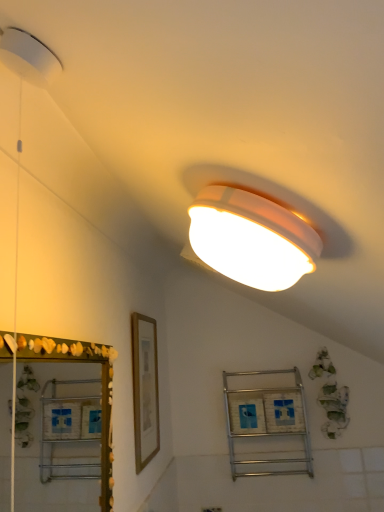
The height and width of the screenshot is (512, 384). Find the location of `white plastic electric outlet at lower center`. white plastic electric outlet at lower center is located at coordinates (211, 509).

The width and height of the screenshot is (384, 512). In order to click on green shell mirror at left in this screenshot , I will do `click(49, 483)`.

Describe the element at coordinates (145, 389) in the screenshot. This screenshot has width=384, height=512. I see `gold wooden picture frame at center-left` at that location.

At what (x,y) coordinates should I click in order to perform the action: click on white plastic electric outlet at lower center. Please return your answer as a coordinate pair (x, y). Looking at the image, I should click on (211, 509).

Can green shell mirror at left be found inside metallic silver shelf at center?

Actually, green shell mirror at left is outside metallic silver shelf at center.

Does metallic silver shelf at center have a greater width compared to green shell mirror at left?

Indeed, metallic silver shelf at center has a greater width compared to green shell mirror at left.

Which of these two, metallic silver shelf at center or green shell mirror at left, is smaller?

green shell mirror at left.

From a real-world perspective, between metallic silver shelf at center and green shell mirror at left, who is vertically higher?

green shell mirror at left is physically above.

Considering the sizes of objects gold wooden picture frame at center-left and green shell mirror at left in the image provided, who is wider, gold wooden picture frame at center-left or green shell mirror at left?

green shell mirror at left is wider.

Are gold wooden picture frame at center-left and green shell mirror at left beside each other?

There is a gap between gold wooden picture frame at center-left and green shell mirror at left.

You are a GUI agent. You are given a task and a screenshot of the screen. Output one action in this format:
    pyautogui.click(x=<x>, y=<y>)
    Task: Click on the picture frame located behind the green shell mirror at left
    This screenshot has height=512, width=384.
    Given the screenshot: What is the action you would take?
    pyautogui.click(x=145, y=389)

How different are the orientations of gold wooden picture frame at center-left and green shell mirror at left in degrees?

0.395 degrees.

Between white plastic electric outlet at lower center and metallic silver shelf at center, which one has smaller width?

white plastic electric outlet at lower center.

What are the coordinates of `electric outlet below the metallic silver shelf at center (from the image's perspective)` in the screenshot? It's located at (211, 509).

From a real-world perspective, which is physically above, white plastic electric outlet at lower center or metallic silver shelf at center?

From a 3D spatial view, metallic silver shelf at center is above.

Is white plastic electric outlet at lower center in front of or behind metallic silver shelf at center in the image?

white plastic electric outlet at lower center is behind metallic silver shelf at center.

Consider the image. Considering the sizes of green shell mirror at left and gold wooden picture frame at center-left in the image, is green shell mirror at left taller or shorter than gold wooden picture frame at center-left?

Clearly, green shell mirror at left is shorter compared to gold wooden picture frame at center-left.

Is green shell mirror at left aimed at gold wooden picture frame at center-left?

No, green shell mirror at left does not turn towards gold wooden picture frame at center-left.

Is green shell mirror at left with gold wooden picture frame at center-left?

No, green shell mirror at left is not next to gold wooden picture frame at center-left.

Does green shell mirror at left appear on the left side of metallic silver shelf at center?

Indeed, green shell mirror at left is positioned on the left side of metallic silver shelf at center.

What are the coordinates of `shelf behind the green shell mirror at left` in the screenshot? It's located at (267, 423).

Between green shell mirror at left and metallic silver shelf at center, which one is positioned in front?

green shell mirror at left is more forward.

Is green shell mirror at left next to metallic silver shelf at center?

No, green shell mirror at left is not with metallic silver shelf at center.

How distant is white plastic electric outlet at lower center from gold wooden picture frame at center-left?

They are 72.80 centimeters apart.

Consider the image. Does white plastic electric outlet at lower center have a smaller size compared to gold wooden picture frame at center-left?

Yes.

Can you confirm if white plastic electric outlet at lower center is positioned to the right of gold wooden picture frame at center-left?

Yes, white plastic electric outlet at lower center is to the right of gold wooden picture frame at center-left.

Do you think white plastic electric outlet at lower center is within gold wooden picture frame at center-left, or outside of it?

The correct answer is: outside.

Looking at their sizes, would you say gold wooden picture frame at center-left is wider or thinner than metallic silver shelf at center?

Clearly, gold wooden picture frame at center-left has less width compared to metallic silver shelf at center.

Can you tell me how much gold wooden picture frame at center-left and metallic silver shelf at center differ in facing direction?

90 degrees separate the facing orientations of gold wooden picture frame at center-left and metallic silver shelf at center.

Identify the location of shelf lying behind the gold wooden picture frame at center-left. This screenshot has height=512, width=384. (267, 423).

From the image's perspective, between gold wooden picture frame at center-left and metallic silver shelf at center, which one is located above?

gold wooden picture frame at center-left appears higher in the image.

The width and height of the screenshot is (384, 512). Identify the location of mirror on the left side of metallic silver shelf at center. (49, 483).

Locate an element on the screen. This screenshot has height=512, width=384. mirror in front of the gold wooden picture frame at center-left is located at coordinates (49, 483).

Which object lies further to the anchor point metallic silver shelf at center, gold wooden picture frame at center-left or green shell mirror at left?

green shell mirror at left lies further to metallic silver shelf at center than the other object.

When comparing their distances from green shell mirror at left, does white plastic electric outlet at lower center or gold wooden picture frame at center-left seem further?

Based on the image, white plastic electric outlet at lower center appears to be further to green shell mirror at left.

Looking at the image, which one is located closer to metallic silver shelf at center, gold wooden picture frame at center-left or white plastic electric outlet at lower center?

white plastic electric outlet at lower center is closer to metallic silver shelf at center.

From the image, which object appears to be farther from white plastic electric outlet at lower center, green shell mirror at left or gold wooden picture frame at center-left?

Based on the image, green shell mirror at left appears to be further to white plastic electric outlet at lower center.

When comparing their distances from white plastic electric outlet at lower center, does green shell mirror at left or metallic silver shelf at center seem closer?

The object closer to white plastic electric outlet at lower center is metallic silver shelf at center.

From the image, which object appears to be nearer to gold wooden picture frame at center-left, metallic silver shelf at center or white plastic electric outlet at lower center?

metallic silver shelf at center is closer to gold wooden picture frame at center-left.

When comparing their distances from gold wooden picture frame at center-left, does green shell mirror at left or white plastic electric outlet at lower center seem further?

white plastic electric outlet at lower center is positioned further to the anchor gold wooden picture frame at center-left.

Considering their positions, is gold wooden picture frame at center-left positioned further to green shell mirror at left than metallic silver shelf at center?

The object further to green shell mirror at left is metallic silver shelf at center.

Locate an element on the screen. This screenshot has height=512, width=384. picture frame between green shell mirror at left and metallic silver shelf at center in the front-back direction is located at coordinates (145, 389).

Locate an element on the screen. This screenshot has width=384, height=512. picture frame between green shell mirror at left and white plastic electric outlet at lower center along the z-axis is located at coordinates pyautogui.click(x=145, y=389).

I want to click on shelf between gold wooden picture frame at center-left and white plastic electric outlet at lower center in the up-down direction, so click(267, 423).

You are a GUI agent. You are given a task and a screenshot of the screen. Output one action in this format:
    pyautogui.click(x=<x>, y=<y>)
    Task: Click on the shelf positioned between green shell mirror at left and white plastic electric outlet at lower center from near to far
    Image resolution: width=384 pixels, height=512 pixels.
    Given the screenshot: What is the action you would take?
    pyautogui.click(x=267, y=423)